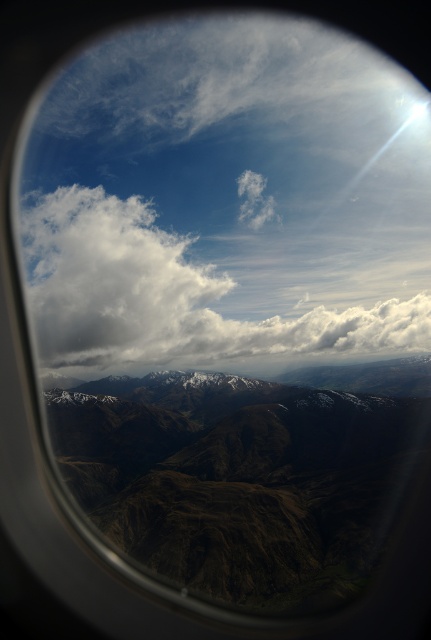
Looking out the airplane window, you see the brown textured mountain range at center and the white fluffy cloud at upper center. Which of these two objects is positioned to the right of the other?

The brown textured mountain range at center is positioned to the right of the white fluffy cloud at upper center.

You are a pilot flying at an altitude of 150 meters. You look out the window and see the brown textured mountain range at center. Is the mountain range closer to or farther away than your current altitude?

The brown textured mountain range at center and viewer are 157.25 meters apart from each other. Since the pilot is flying at 150 meters, the mountain range is slightly farther away than the current altitude by approximately 7.25 meters.

You are a pilot looking out the airplane window and see the brown textured mountain range at center and the white fluffy cloud at upper center. Which object appears closer to the airplane based on their positions?

The white fluffy cloud at upper center appears closer to the airplane than the brown textured mountain range at center because it is positioned higher in the image, which typically indicates proximity in aerial views.